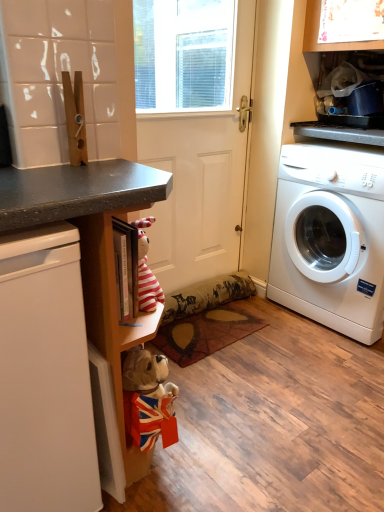
Question: Does white matte dishwasher at left appear on the left side of white plastic washing machine at right?

Choices:
 (A) yes
 (B) no

Answer: (A)

Question: From the image's perspective, is white matte dishwasher at left below white plastic washing machine at right?

Choices:
 (A) no
 (B) yes

Answer: (B)

Question: Is white matte dishwasher at left located outside white plastic washing machine at right?

Choices:
 (A) no
 (B) yes

Answer: (B)

Question: Considering the relative sizes of white matte dishwasher at left and white plastic washing machine at right in the image provided, is white matte dishwasher at left wider than white plastic washing machine at right?

Choices:
 (A) no
 (B) yes

Answer: (B)

Question: Are white matte dishwasher at left and white plastic washing machine at right far apart?

Choices:
 (A) no
 (B) yes

Answer: (B)

Question: In terms of width, does patterned fabric mat at center look wider or thinner when compared to matte black counter at lower left?

Choices:
 (A) wide
 (B) thin

Answer: (B)

Question: Considering the relative positions of patterned fabric mat at center and matte black counter at lower left in the image provided, is patterned fabric mat at center to the left or to the right of matte black counter at lower left?

Choices:
 (A) right
 (B) left

Answer: (A)

Question: From the image's perspective, is patterned fabric mat at center located above or below matte black counter at lower left?

Choices:
 (A) above
 (B) below

Answer: (B)

Question: Is patterned fabric mat at center situated inside matte black counter at lower left or outside?

Choices:
 (A) outside
 (B) inside

Answer: (A)

Question: Visually, is patterned fabric mat at center positioned to the left or to the right of white matte screen door at center?

Choices:
 (A) left
 (B) right

Answer: (B)

Question: Do you think patterned fabric mat at center is within white matte screen door at center, or outside of it?

Choices:
 (A) outside
 (B) inside

Answer: (A)

Question: Looking at their shapes, would you say patterned fabric mat at center is wider or thinner than white matte screen door at center?

Choices:
 (A) wide
 (B) thin

Answer: (A)

Question: Is patterned fabric mat at center in front of or behind white matte screen door at center in the image?

Choices:
 (A) behind
 (B) front

Answer: (A)

Question: Considering their positions, is white plastic washing machine at right located in front of or behind white matte dishwasher at left?

Choices:
 (A) front
 (B) behind

Answer: (B)

Question: Is white plastic washing machine at right situated inside white matte dishwasher at left or outside?

Choices:
 (A) inside
 (B) outside

Answer: (B)